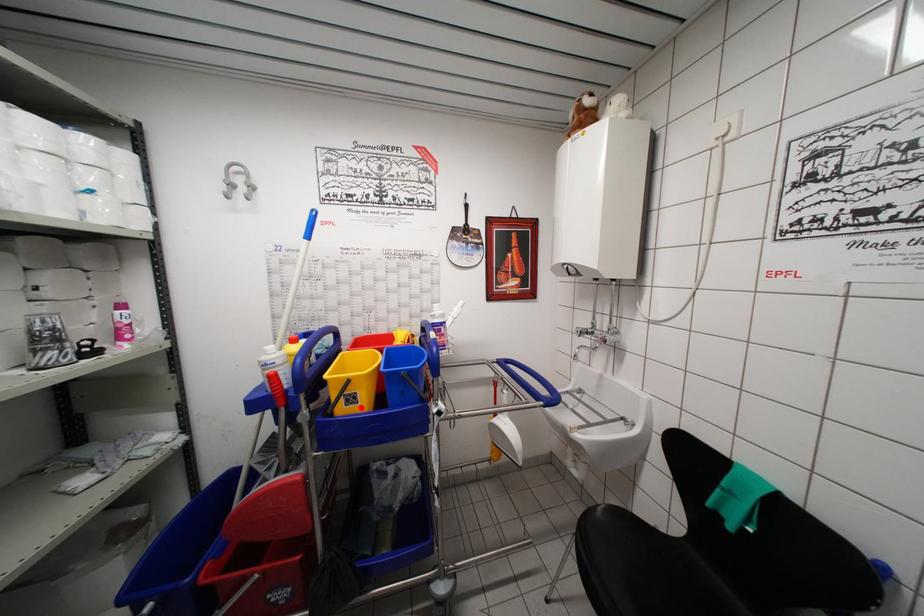
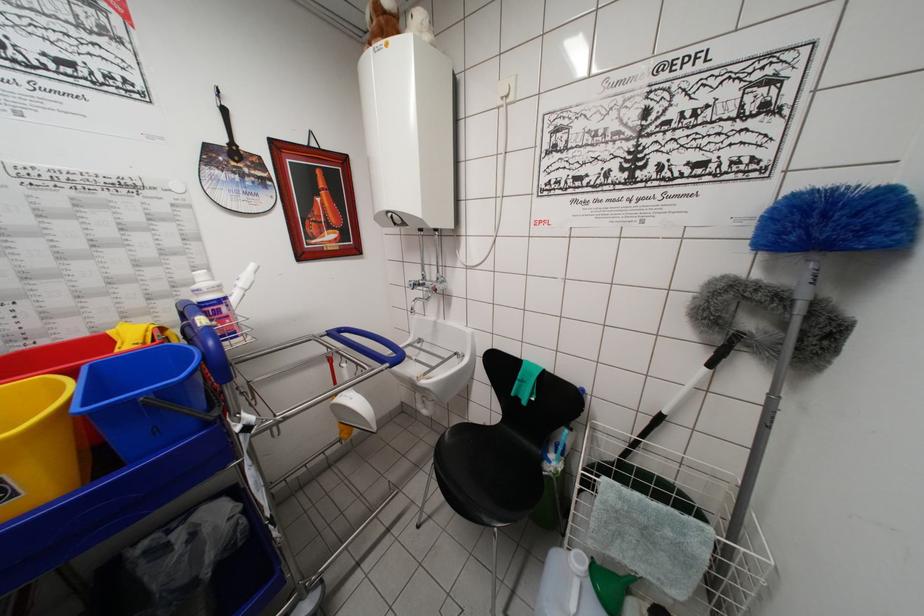
In the second image, find the point that corresponds to the highlighted location in the first image.

(20, 500)